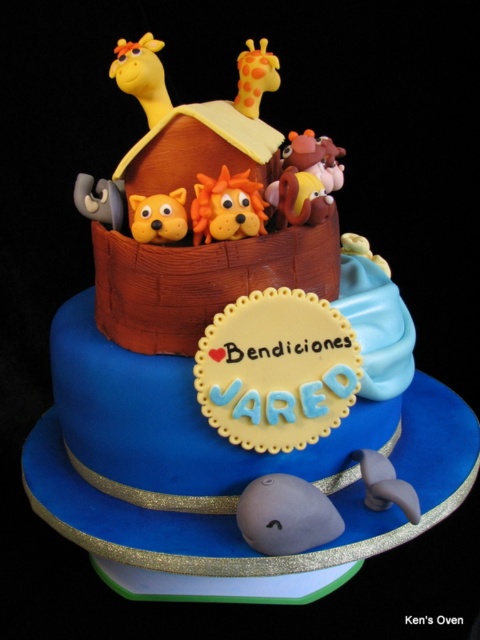
You are a guest at a birthday party and want to take a photo of the cake. You notice the yellow fondant giraffe at upper left and the orange matte dog at center. Which animal should you focus on if you want to capture the one closer to the right side of the cake?

The orange matte dog at center is closer to the right side of the cake than the yellow fondant giraffe at upper left.

Looking at the Noah Ark themed cake, you notice an orange matte dog at center and a matte brown bear at upper center. Which of these two animals is shorter in height?

The orange matte dog at center is shorter in height compared to the matte brown bear at upper center.

Looking at the Noah Ark themed cake, you notice the orange matte dog at center and the matte brown bear at upper center. Which of these two animals is smaller in size?

The orange matte dog at center is smaller in size compared to the matte brown bear at upper center.